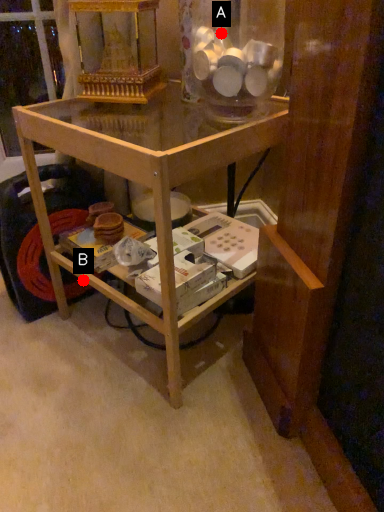
Question: Two points are circled on the image, labeled by A and B beside each circle. Among these points, which one is nearest to the camera?

Choices:
 (A) A is closer
 (B) B is closer

Answer: (A)